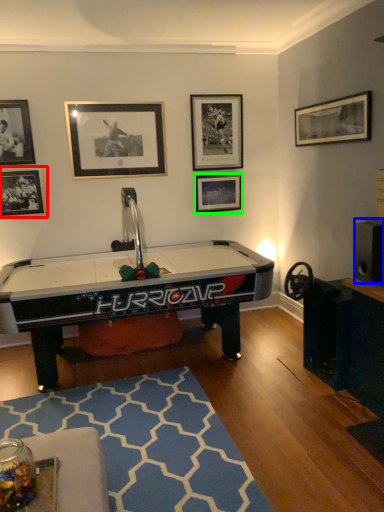
Question: Based on their relative distances, which object is farther from picture frame (highlighted by a red box)? Choose from speaker (highlighted by a blue box) and picture frame (highlighted by a green box).

Choices:
 (A) speaker
 (B) picture frame

Answer: (A)